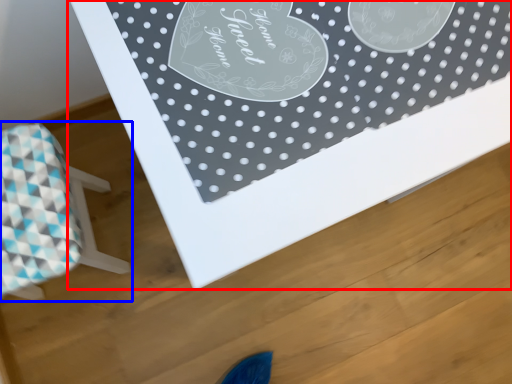
Question: Which object appears farthest to the camera in this image, table (highlighted by a red box) or furniture (highlighted by a blue box)?

Choices:
 (A) table
 (B) furniture

Answer: (B)